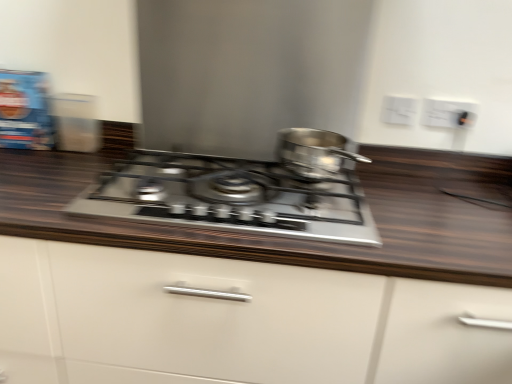
I want to click on white plastic electric outlet at upper right, positioned as the 1th electric outlet in right-to-left order, so click(448, 113).

What is the approximate height of white plastic electric outlet at upper right, arranged as the first electric outlet when viewed from the left?

white plastic electric outlet at upper right, arranged as the first electric outlet when viewed from the left, is 3.49 inches in height.

Identify the location of satin silver gas stove at center. (231, 197).

Identify the location of white plastic electric outlet at upper right, acting as the second electric outlet starting from the left. The height and width of the screenshot is (384, 512). (448, 113).

From a real-world perspective, is satin silver pot at center located beneath satin silver gas stove at center?

Actually, satin silver pot at center is physically above satin silver gas stove at center in the real world.

Is satin silver pot at center outside of satin silver gas stove at center?

Yes.

In the image, is satin silver pot at center on the left side or the right side of satin silver gas stove at center?

Based on their positions, satin silver pot at center is located to the right of satin silver gas stove at center.

Is the surface of satin silver pot at center in direct contact with satin silver gas stove at center?

They are not placed beside each other.

Between white matte cabinet at center and satin silver gas stove at center, which one has less height?

satin silver gas stove at center is shorter.

From the image's perspective, is white matte cabinet at center located beneath satin silver gas stove at center?

Correct, white matte cabinet at center appears lower than satin silver gas stove at center in the image.

This screenshot has height=384, width=512. In order to click on gas stove on the left of the white matte cabinet at center in this screenshot , I will do `click(231, 197)`.

Which object is further away from the camera taking this photo, white matte cabinet at center or satin silver gas stove at center?

satin silver gas stove at center.

From the image's perspective, would you say satin silver gas stove at center is shown under white plastic electric outlet at upper right, which is the 2th electric outlet in right-to-left order?

Correct, satin silver gas stove at center appears lower than white plastic electric outlet at upper right, which is the 2th electric outlet in right-to-left order, in the image.

Is satin silver gas stove at center oriented away from white plastic electric outlet at upper right, which is the 2th electric outlet in right-to-left order?

That's not correct — satin silver gas stove at center is not looking away from white plastic electric outlet at upper right, which is the 2th electric outlet in right-to-left order.

From a real-world perspective, which is physically above, satin silver gas stove at center or white plastic electric outlet at upper right, which is the 2th electric outlet in right-to-left order?

white plastic electric outlet at upper right, which is the 2th electric outlet in right-to-left order.

Based on the photo, from the image's perspective, is satin silver gas stove at center located above satin silver pot at center?

No, from the image's perspective, satin silver gas stove at center is not on top of satin silver pot at center.

Looking at this image, is satin silver gas stove at center inside the boundaries of satin silver pot at center, or outside?

satin silver gas stove at center is located beyond the bounds of satin silver pot at center.

Considering the sizes of satin silver gas stove at center and satin silver pot at center in the image, is satin silver gas stove at center bigger or smaller than satin silver pot at center?

Clearly, satin silver gas stove at center is larger in size than satin silver pot at center.

Is satin silver pot at center to the left of white plastic electric outlet at upper right, positioned as the 1th electric outlet in right-to-left order, from the viewer's perspective?

Yes, satin silver pot at center is to the left of white plastic electric outlet at upper right, positioned as the 1th electric outlet in right-to-left order.

Does satin silver pot at center have a greater height compared to white plastic electric outlet at upper right, acting as the second electric outlet starting from the left?

Yes.

At what (x,y) coordinates should I click in order to perform the action: click on gas stove lying on the left of white matte cabinet at center. Please return your answer as a coordinate pair (x, y). The image size is (512, 384). Looking at the image, I should click on (231, 197).

Would you say satin silver gas stove at center is inside or outside white matte cabinet at center?

satin silver gas stove at center is enclosed within white matte cabinet at center.

Is the surface of satin silver gas stove at center in direct contact with white matte cabinet at center?

No, satin silver gas stove at center is not with white matte cabinet at center.

Considering the relative sizes of white plastic electric outlet at upper right, acting as the second electric outlet starting from the left, and white matte cabinet at center in the image provided, is white plastic electric outlet at upper right, acting as the second electric outlet starting from the left, thinner than white matte cabinet at center?

Indeed, white plastic electric outlet at upper right, acting as the second electric outlet starting from the left, has a lesser width compared to white matte cabinet at center.

Which is more to the left, white plastic electric outlet at upper right, acting as the second electric outlet starting from the left, or white matte cabinet at center?

Positioned to the left is white matte cabinet at center.

Is white matte cabinet at center at the back of white plastic electric outlet at upper right, positioned as the 1th electric outlet in right-to-left order?

white plastic electric outlet at upper right, positioned as the 1th electric outlet in right-to-left order, does not have its back to white matte cabinet at center.

Consider the image. Is white plastic electric outlet at upper right, positioned as the 1th electric outlet in right-to-left order, inside or outside of white matte cabinet at center?

white plastic electric outlet at upper right, positioned as the 1th electric outlet in right-to-left order, is located beyond the bounds of white matte cabinet at center.

You are a GUI agent. You are given a task and a screenshot of the screen. Output one action in this format:
    pyautogui.click(x=<x>, y=<y>)
    Task: Click on the gas stove that is under the satin silver pot at center (from a real-world perspective)
    
    Given the screenshot: What is the action you would take?
    pyautogui.click(x=231, y=197)

Locate an element on the screen. The width and height of the screenshot is (512, 384). cabinetry that is below the satin silver gas stove at center (from the image's perspective) is located at coordinates (244, 319).

When comparing their distances from white plastic electric outlet at upper right, acting as the second electric outlet starting from the left, does white matte cabinet at center or satin silver gas stove at center seem further?

Based on the image, white matte cabinet at center appears to be further to white plastic electric outlet at upper right, acting as the second electric outlet starting from the left.

Considering their positions, is satin silver pot at center positioned closer to white plastic electric outlet at upper right, which is the 2th electric outlet in right-to-left order, than satin silver gas stove at center?

satin silver pot at center is closer to white plastic electric outlet at upper right, which is the 2th electric outlet in right-to-left order.

Based on their spatial positions, is white plastic electric outlet at upper right, which is the 2th electric outlet in right-to-left order, or satin silver pot at center closer to satin silver gas stove at center?

satin silver pot at center.

Estimate the real-world distances between objects in this image. Which object is closer to satin silver gas stove at center, white plastic electric outlet at upper right, arranged as the first electric outlet when viewed from the left, or white plastic electric outlet at upper right, acting as the second electric outlet starting from the left?

Among the two, white plastic electric outlet at upper right, arranged as the first electric outlet when viewed from the left, is located nearer to satin silver gas stove at center.

When comparing their distances from white plastic electric outlet at upper right, acting as the second electric outlet starting from the left, does white matte cabinet at center or white plastic electric outlet at upper right, which is the 2th electric outlet in right-to-left order, seem closer?

Based on the image, white plastic electric outlet at upper right, which is the 2th electric outlet in right-to-left order, appears to be nearer to white plastic electric outlet at upper right, acting as the second electric outlet starting from the left.

From the image, which object appears to be nearer to white plastic electric outlet at upper right, arranged as the first electric outlet when viewed from the left, satin silver pot at center or white matte cabinet at center?

satin silver pot at center.

Looking at the image, which one is located closer to white matte cabinet at center, satin silver gas stove at center or white plastic electric outlet at upper right, arranged as the first electric outlet when viewed from the left?

The object closer to white matte cabinet at center is satin silver gas stove at center.

From the image, which object appears to be nearer to white plastic electric outlet at upper right, positioned as the 1th electric outlet in right-to-left order, satin silver pot at center or white plastic electric outlet at upper right, arranged as the first electric outlet when viewed from the left?

white plastic electric outlet at upper right, arranged as the first electric outlet when viewed from the left, is closer to white plastic electric outlet at upper right, positioned as the 1th electric outlet in right-to-left order.

Find the location of a particular element. gas stove that lies between satin silver pot at center and white matte cabinet at center from top to bottom is located at coordinates (231, 197).

At what (x,y) coordinates should I click in order to perform the action: click on electric outlet between satin silver pot at center and white plastic electric outlet at upper right, positioned as the 1th electric outlet in right-to-left order. Please return your answer as a coordinate pair (x, y). Looking at the image, I should click on (398, 110).

Find the location of a particular element. Image resolution: width=512 pixels, height=384 pixels. electric outlet between white plastic electric outlet at upper right, which is the 2th electric outlet in right-to-left order, and white matte cabinet at center in the up-down direction is located at coordinates (448, 113).

Where is `cabinetry situated between satin silver gas stove at center and white plastic electric outlet at upper right, positioned as the 1th electric outlet in right-to-left order, from left to right`? The width and height of the screenshot is (512, 384). cabinetry situated between satin silver gas stove at center and white plastic electric outlet at upper right, positioned as the 1th electric outlet in right-to-left order, from left to right is located at coordinates (244, 319).